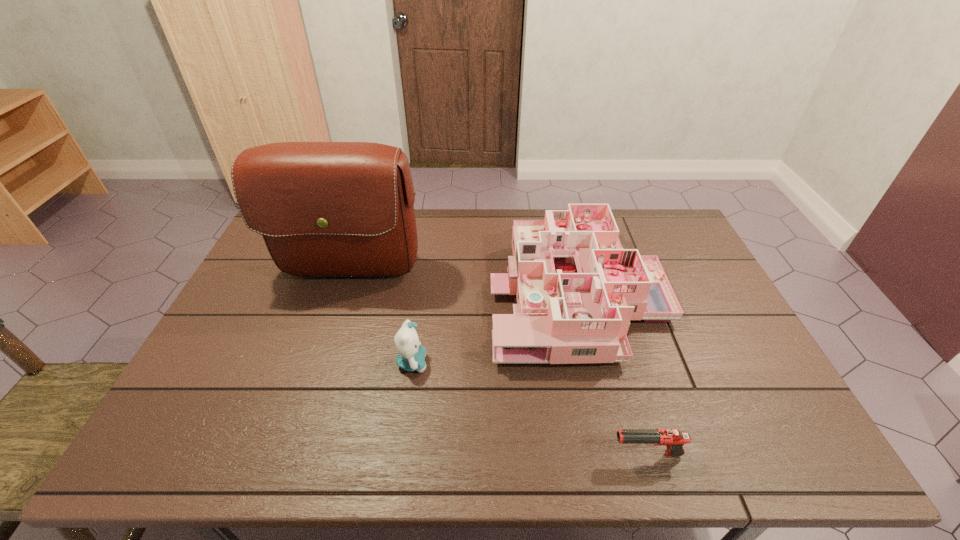
I want to click on blank space located at the aiming end of the nearest object, so click(x=472, y=454).

You are a GUI agent. You are given a task and a screenshot of the screen. Output one action in this format:
    pyautogui.click(x=<x>, y=<y>)
    Task: Click on the free location located 0.350m at the aiming end of the nearest object
    
    Given the screenshot: What is the action you would take?
    pyautogui.click(x=454, y=454)

Locate an element on the screen. The height and width of the screenshot is (540, 960). vacant space situated at the aiming end of the nearest object is located at coordinates (499, 454).

Locate an element on the screen. object located in the far edge section of the desktop is located at coordinates (577, 289).

Where is `object present at the near edge`? The image size is (960, 540). object present at the near edge is located at coordinates (674, 440).

Image resolution: width=960 pixels, height=540 pixels. I want to click on object situated at the left edge, so click(325, 209).

The image size is (960, 540). In order to click on free space at the far edge of the desktop in this screenshot , I will do `click(629, 232)`.

You are a GUI agent. You are given a task and a screenshot of the screen. Output one action in this format:
    pyautogui.click(x=<x>, y=<y>)
    Task: Click on the vacant region at the near edge of the desktop
    The height and width of the screenshot is (540, 960).
    Given the screenshot: What is the action you would take?
    pyautogui.click(x=340, y=458)

In the image, there is a desktop. Identify the location of vacant area at the left edge. (237, 313).

Where is `free region at the right edge`? The image size is (960, 540). free region at the right edge is located at coordinates (701, 321).